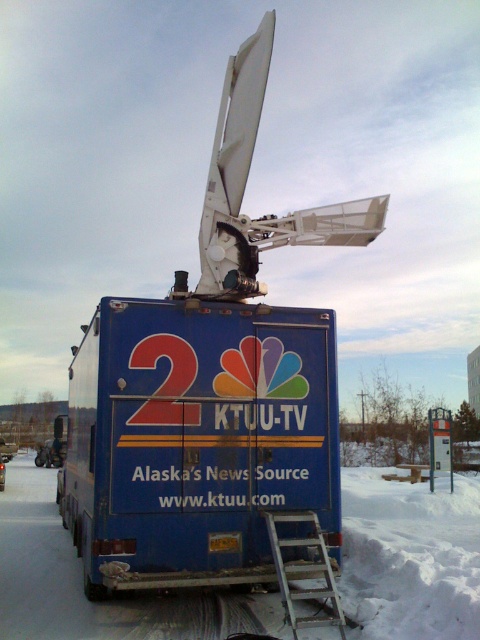
Is blue matte truck at center below silver metallic ladder at lower center?

No, blue matte truck at center is not below silver metallic ladder at lower center.

Is point (261, 312) farther from viewer compared to point (296, 518)?

That is True.

This screenshot has width=480, height=640. I want to click on blue matte truck at center, so click(197, 440).